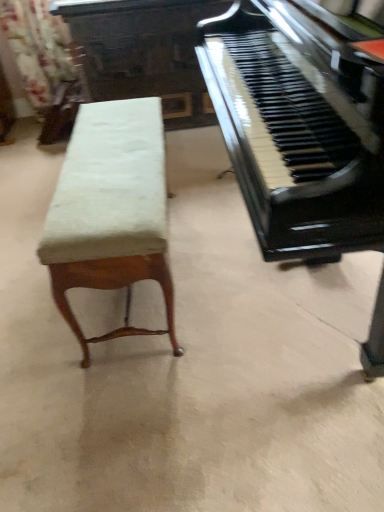
Question: Is velvet upholstered bench at left smaller than black polished wood piano at right?

Choices:
 (A) no
 (B) yes

Answer: (B)

Question: Is velvet upholstered bench at left directly adjacent to black polished wood piano at right?

Choices:
 (A) yes
 (B) no

Answer: (B)

Question: Can you confirm if velvet upholstered bench at left is thinner than black polished wood piano at right?

Choices:
 (A) no
 (B) yes

Answer: (B)

Question: Does velvet upholstered bench at left contain black polished wood piano at right?

Choices:
 (A) yes
 (B) no

Answer: (B)

Question: Is the depth of velvet upholstered bench at left greater than that of black polished wood piano at right?

Choices:
 (A) yes
 (B) no

Answer: (A)

Question: From a real-world perspective, is velvet upholstered bench at left positioned above or below floral fabric curtain at upper left?

Choices:
 (A) above
 (B) below

Answer: (B)

Question: Do you think velvet upholstered bench at left is within floral fabric curtain at upper left, or outside of it?

Choices:
 (A) outside
 (B) inside

Answer: (A)

Question: Is point (158, 273) positioned closer to the camera than point (36, 55)?

Choices:
 (A) farther
 (B) closer

Answer: (B)

Question: From their relative heights in the image, would you say velvet upholstered bench at left is taller or shorter than floral fabric curtain at upper left?

Choices:
 (A) tall
 (B) short

Answer: (B)

Question: From a real-world perspective, is floral fabric curtain at upper left positioned above or below velvet upholstered bench at left?

Choices:
 (A) below
 (B) above

Answer: (B)

Question: Considering the positions of point (36, 18) and point (124, 103), is point (36, 18) closer or farther from the camera than point (124, 103)?

Choices:
 (A) closer
 (B) farther

Answer: (B)

Question: From the image's perspective, relative to velvet upholstered bench at left, is floral fabric curtain at upper left above or below?

Choices:
 (A) below
 (B) above

Answer: (B)

Question: Relative to velvet upholstered bench at left, is floral fabric curtain at upper left in front or behind?

Choices:
 (A) behind
 (B) front

Answer: (A)

Question: From a real-world perspective, is velvet upholstered bench at left above or below black polished wood piano at right?

Choices:
 (A) above
 (B) below

Answer: (B)

Question: From their relative heights in the image, would you say velvet upholstered bench at left is taller or shorter than black polished wood piano at right?

Choices:
 (A) short
 (B) tall

Answer: (A)